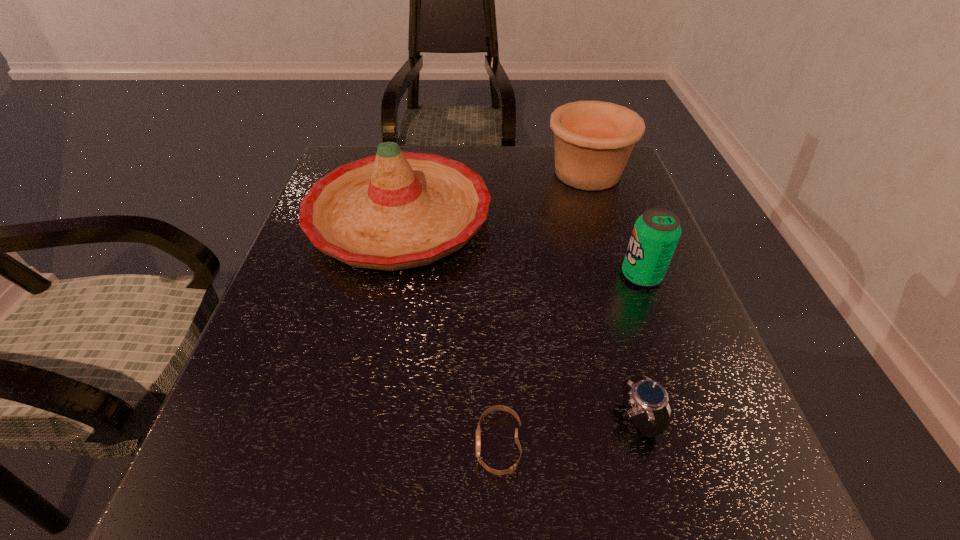
Find the location of `vacant space at the far right corner of the desktop`. vacant space at the far right corner of the desktop is located at coordinates (578, 189).

Where is `vacant space at the near right corner of the desktop`? vacant space at the near right corner of the desktop is located at coordinates (745, 516).

You are a GUI agent. You are given a task and a screenshot of the screen. Output one action in this format:
    pyautogui.click(x=<x>, y=<y>)
    Task: Click on the free space that is in between the shortest object and the sombrero
    
    Given the screenshot: What is the action you would take?
    pyautogui.click(x=449, y=331)

The width and height of the screenshot is (960, 540). I want to click on free space that is in between the taller watch and the pop soda, so click(639, 347).

You are a GUI agent. You are given a task and a screenshot of the screen. Output one action in this format:
    pyautogui.click(x=<x>, y=<y>)
    Task: Click on the free point between the shorter watch and the pottery
    The width and height of the screenshot is (960, 540).
    Given the screenshot: What is the action you would take?
    pyautogui.click(x=542, y=309)

Locate an element on the screen. Image resolution: width=960 pixels, height=540 pixels. free space between the pop soda and the shorter watch is located at coordinates (570, 360).

At what (x,y) coordinates should I click in order to perform the action: click on vacant region between the tallest object and the right watch. Please return your answer as a coordinate pair (x, y). This screenshot has width=960, height=540. Looking at the image, I should click on (518, 318).

Where is `unoccupied position between the fourth tallest object and the tallest object`? unoccupied position between the fourth tallest object and the tallest object is located at coordinates (518, 318).

The width and height of the screenshot is (960, 540). Find the location of `free space between the left watch and the second shortest object`. free space between the left watch and the second shortest object is located at coordinates (567, 431).

This screenshot has height=540, width=960. What are the coordinates of `vacant space that is in between the pottery and the pop soda` in the screenshot? It's located at (614, 224).